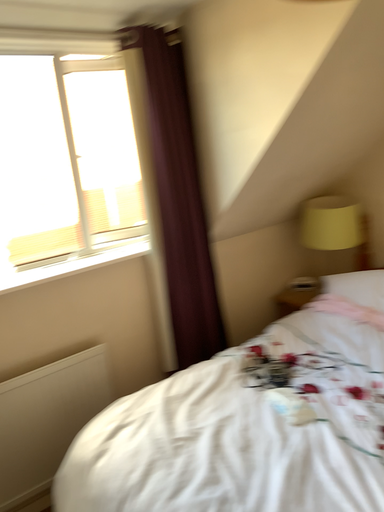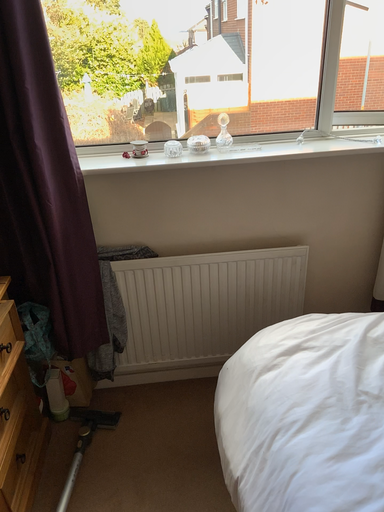
Question: Which way did the camera rotate in the video?

Choices:
 (A) rotated upward
 (B) rotated downward

Answer: (B)